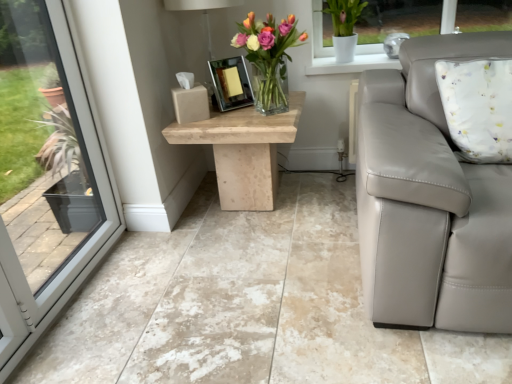
Locate an element on the screen. The height and width of the screenshot is (384, 512). free space in front of shiny silver picture frame at center is located at coordinates (225, 117).